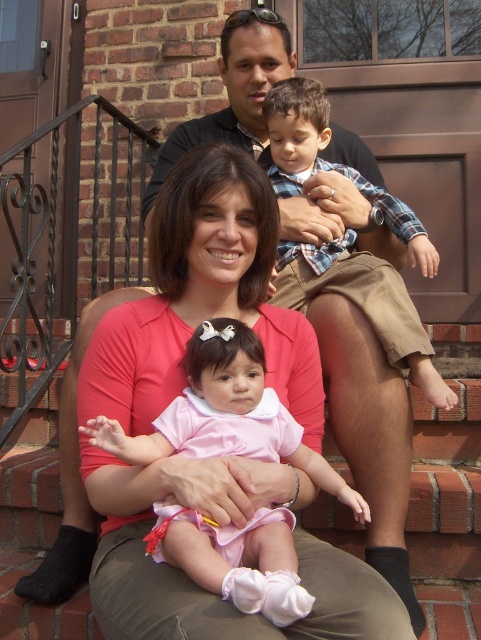
You are a photographer setting up for a family portrait. You need to position the pink satin dress at center and the plaid cotton shirt at upper right in the frame. Based on the scene, which object is positioned lower in the image?

The pink satin dress at center is located below the plaid cotton shirt at upper right, so it is positioned lower in the image.

You are a photographer standing 1.5 meters away from the brick wall. You want to take a photo of the pink satin dress at center. Can you reach the dress within your current position without moving closer than 1.5 meters?

The photographer is 1.5 meters away from the brick wall, and the pink satin dress at center is 1.14 meters away from them. Since 1.14 meters is less than 1.5 meters, the photographer can reach the dress without moving closer than 1.5 meters.